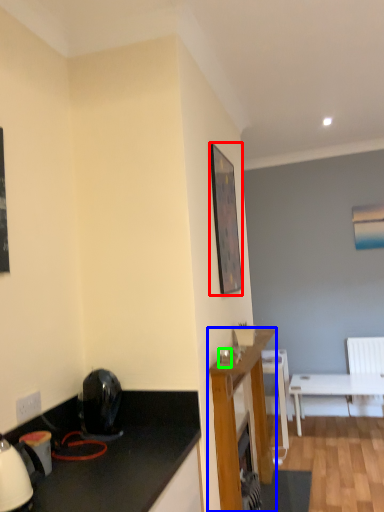
Question: Which is nearer to the picture frame (highlighted by a red box)? cabinetry (highlighted by a blue box) or coffee cup (highlighted by a green box).

Choices:
 (A) cabinetry
 (B) coffee cup

Answer: (B)